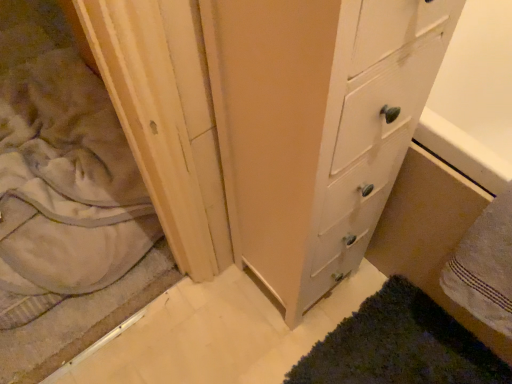
The height and width of the screenshot is (384, 512). Find the location of `free spot in front of white wood chest of drawers at center`. free spot in front of white wood chest of drawers at center is located at coordinates (280, 342).